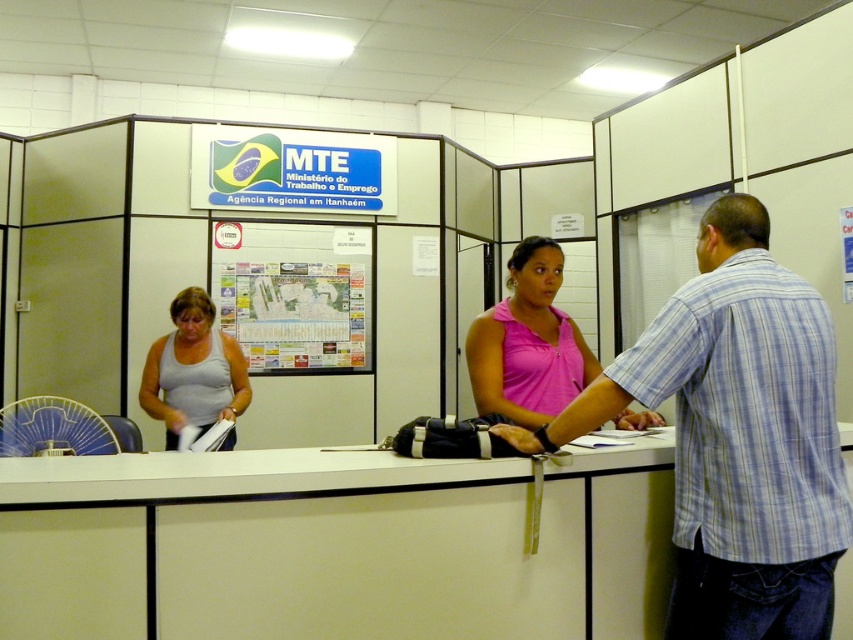
Question: Can you confirm if white matte desk at center is bigger than gray matte tank top at center?

Choices:
 (A) no
 (B) yes

Answer: (B)

Question: Is pink matte tank top at center below clear plastic fan at left?

Choices:
 (A) no
 (B) yes

Answer: (A)

Question: Observing the image, what is the correct spatial positioning of plaid cotton shirt at center in reference to clear plastic fan at left?

Choices:
 (A) above
 (B) below

Answer: (A)

Question: Which of the following is the closest to the observer?

Choices:
 (A) white matte desk at center
 (B) plaid cotton shirt at center

Answer: (A)

Question: Which of the following is the closest to the observer?

Choices:
 (A) clear plastic fan at left
 (B) plaid cotton shirt at center
 (C) pink matte tank top at center

Answer: (B)

Question: Which point is closer to the camera?

Choices:
 (A) pink matte tank top at center
 (B) gray matte tank top at center
 (C) white matte desk at center

Answer: (C)